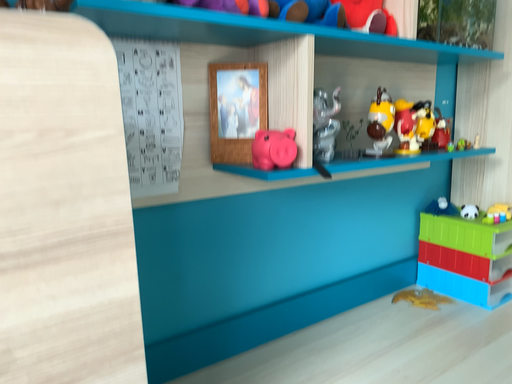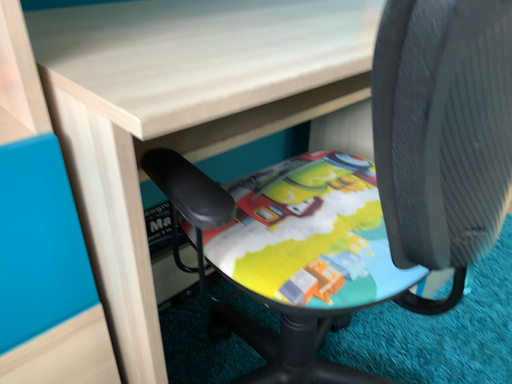
Question: How did the camera likely rotate when shooting the video?

Choices:
 (A) rotated downward
 (B) rotated upward

Answer: (A)